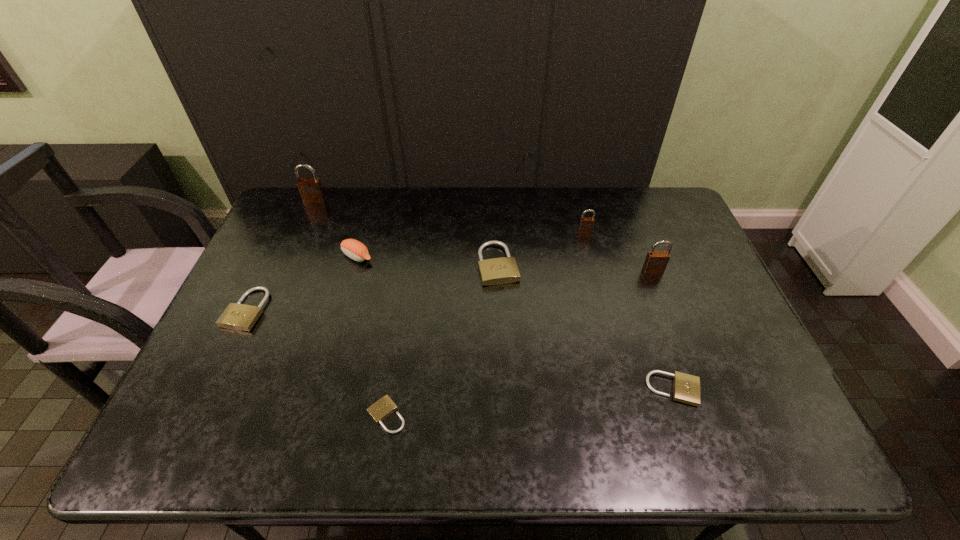
Where is `the second closest beige padlock to the salmon sushi`? This screenshot has height=540, width=960. the second closest beige padlock to the salmon sushi is located at coordinates (504, 270).

This screenshot has width=960, height=540. Identify the location of beige padlock that is the third closest to the fifth padlock from right to left. (686, 388).

The height and width of the screenshot is (540, 960). Find the location of `free location that satisfies the following two spatial constraints: 1. on the front-facing side of the smallest beige padlock; 2. on the right side of the farthest brown padlock`. free location that satisfies the following two spatial constraints: 1. on the front-facing side of the smallest beige padlock; 2. on the right side of the farthest brown padlock is located at coordinates (222, 415).